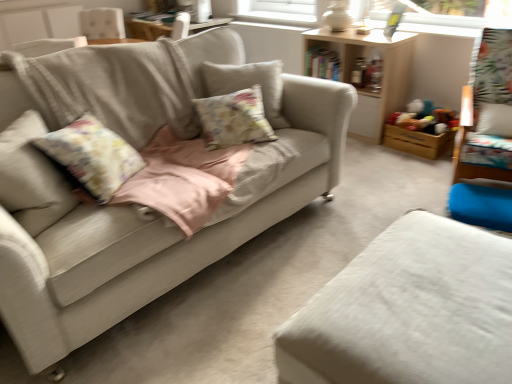
Question: From a real-world perspective, is wooden swivel chair at right physically below white fabric ottoman at lower right, positioned as the first studio couch in right-to-left order?

Choices:
 (A) no
 (B) yes

Answer: (A)

Question: Can you confirm if wooden swivel chair at right is smaller than white fabric ottoman at lower right, the 2th studio couch in the left-to-right sequence?

Choices:
 (A) yes
 (B) no

Answer: (B)

Question: Is white fabric ottoman at lower right, positioned as the first studio couch in right-to-left order, a part of wooden swivel chair at right?

Choices:
 (A) yes
 (B) no

Answer: (B)

Question: Is wooden swivel chair at right oriented towards white fabric ottoman at lower right, the 2th studio couch in the left-to-right sequence?

Choices:
 (A) yes
 (B) no

Answer: (A)

Question: Is wooden swivel chair at right far from white fabric ottoman at lower right, positioned as the first studio couch in right-to-left order?

Choices:
 (A) yes
 (B) no

Answer: (A)

Question: Is wooden swivel chair at right looking in the opposite direction of white fabric ottoman at lower right, positioned as the first studio couch in right-to-left order?

Choices:
 (A) no
 (B) yes

Answer: (A)

Question: Is wooden swivel chair at right to the left of wooden toy box at right from the viewer's perspective?

Choices:
 (A) no
 (B) yes

Answer: (A)

Question: Can you confirm if wooden swivel chair at right is taller than wooden toy box at right?

Choices:
 (A) yes
 (B) no

Answer: (A)

Question: Does wooden swivel chair at right appear on the right side of wooden toy box at right?

Choices:
 (A) no
 (B) yes

Answer: (B)

Question: Is wooden swivel chair at right completely or partially outside of wooden toy box at right?

Choices:
 (A) no
 (B) yes

Answer: (B)

Question: Is wooden swivel chair at right with wooden toy box at right?

Choices:
 (A) yes
 (B) no

Answer: (B)

Question: From the image's perspective, is wooden swivel chair at right below wooden toy box at right?

Choices:
 (A) yes
 (B) no

Answer: (B)

Question: Is wooden shelf at upper center facing away from white fabric ottoman at lower right, the 2th studio couch in the left-to-right sequence?

Choices:
 (A) no
 (B) yes

Answer: (A)